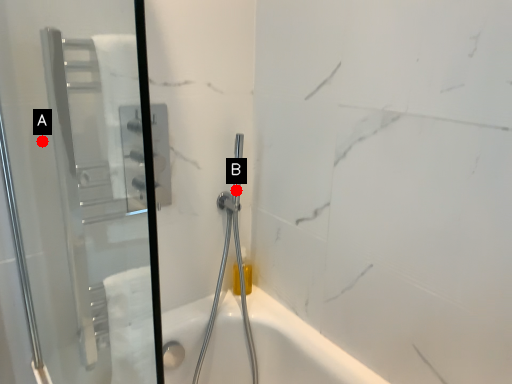
Question: Two points are circled on the image, labeled by A and B beside each circle. Which point is further to the camera?

Choices:
 (A) A is further
 (B) B is further

Answer: (B)